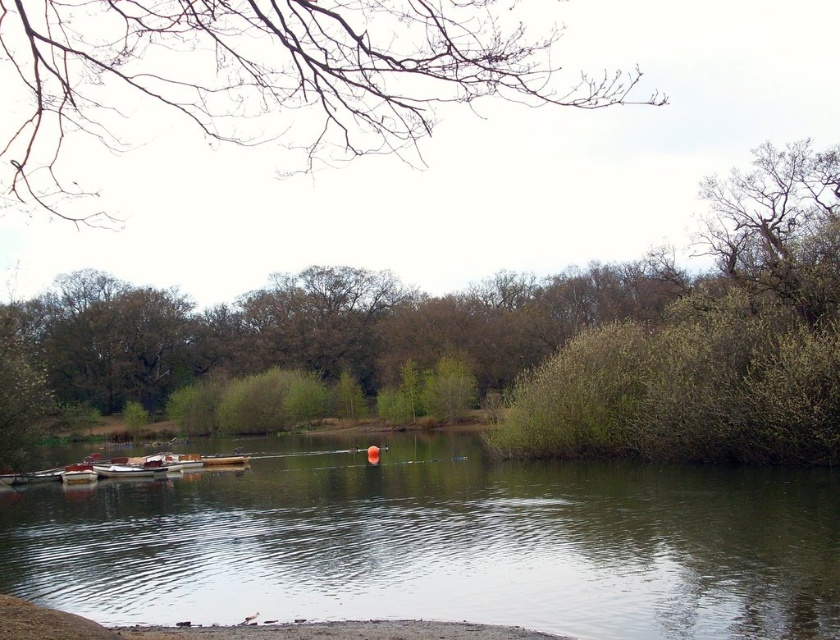
Question: Which point appears closest to the camera in this image?

Choices:
 (A) (206, 460)
 (B) (92, 477)
 (C) (444, 3)

Answer: (C)

Question: Considering the relative positions of green reflective water at center and wooden boat at lower left in the image provided, where is green reflective water at center located with respect to wooden boat at lower left?

Choices:
 (A) below
 (B) above

Answer: (B)

Question: Among these objects, which one is farthest from the camera?

Choices:
 (A) green leafy tree at center
 (B) bare branches at upper left
 (C) wooden boat at center
 (D) wooden boat at lower left

Answer: (C)

Question: Does bare branches at upper left appear on the left side of wooden boat at center?

Choices:
 (A) yes
 (B) no

Answer: (A)

Question: Is green leafy tree at center thinner than bare branches at upper left?

Choices:
 (A) yes
 (B) no

Answer: (A)

Question: Among these objects, which one is nearest to the camera?

Choices:
 (A) green reflective water at center
 (B) bare branches at upper left
 (C) wooden boat at lower left
 (D) wooden boat at center

Answer: (B)